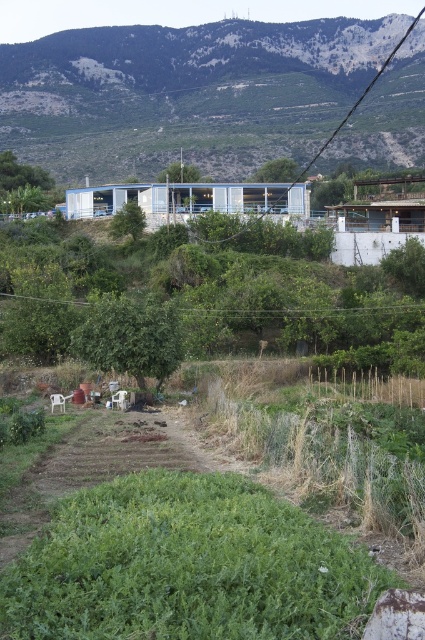
Between point (102, 147) and point (334, 307), which one is positioned behind?

Positioned behind is point (102, 147).

Can you confirm if green grassy hillside at upper center is positioned below green wire at center?

Incorrect, green grassy hillside at upper center is not positioned below green wire at center.

What do you see at coordinates (184, 93) in the screenshot? This screenshot has width=425, height=640. I see `green grassy hillside at upper center` at bounding box center [184, 93].

This screenshot has width=425, height=640. I want to click on green grassy hillside at upper center, so click(x=184, y=93).

Is green grassy hillside at upper center above black wire at upper center?

Correct, green grassy hillside at upper center is located above black wire at upper center.

Identify the location of green grassy hillside at upper center. This screenshot has width=425, height=640. (184, 93).

I want to click on green grassy hillside at upper center, so point(184,93).

At what (x,y) coordinates should I click in order to perform the action: click on green grassy hillside at upper center. Please return your answer as a coordinate pair (x, y). Looking at the image, I should click on (184, 93).

What do you see at coordinates (368, 308) in the screenshot? I see `green wire at center` at bounding box center [368, 308].

What are the coordinates of `green wire at center` in the screenshot? It's located at (368, 308).

Does point (328, 312) lie behind point (337, 131)?

That is False.

The height and width of the screenshot is (640, 425). I want to click on green wire at center, so [368, 308].